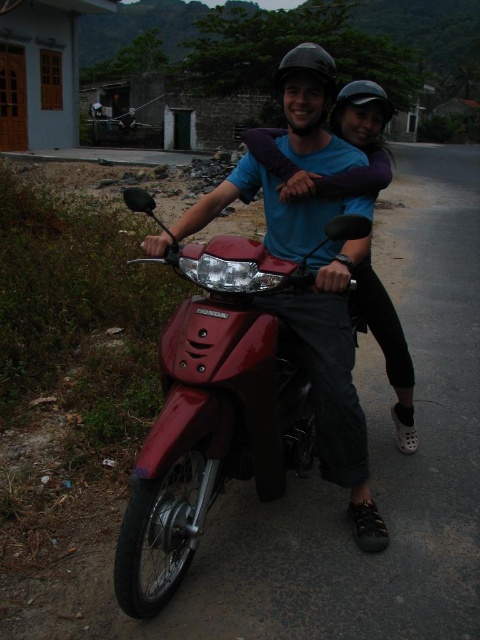
Question: Can you confirm if glossy red motorcycle at center is bigger than matte purple shirt at center?

Choices:
 (A) no
 (B) yes

Answer: (B)

Question: Does glossy red motorcycle at center appear on the left side of matte purple shirt at center?

Choices:
 (A) yes
 (B) no

Answer: (A)

Question: Which object appears farthest from the camera in this image?

Choices:
 (A) matte purple shirt at center
 (B) glossy red motorcycle at center

Answer: (A)

Question: Does glossy red motorcycle at center lie behind matte purple shirt at center?

Choices:
 (A) yes
 (B) no

Answer: (B)

Question: Among these points, which one is nearest to the camera?

Choices:
 (A) (260, 378)
 (B) (345, 196)

Answer: (A)